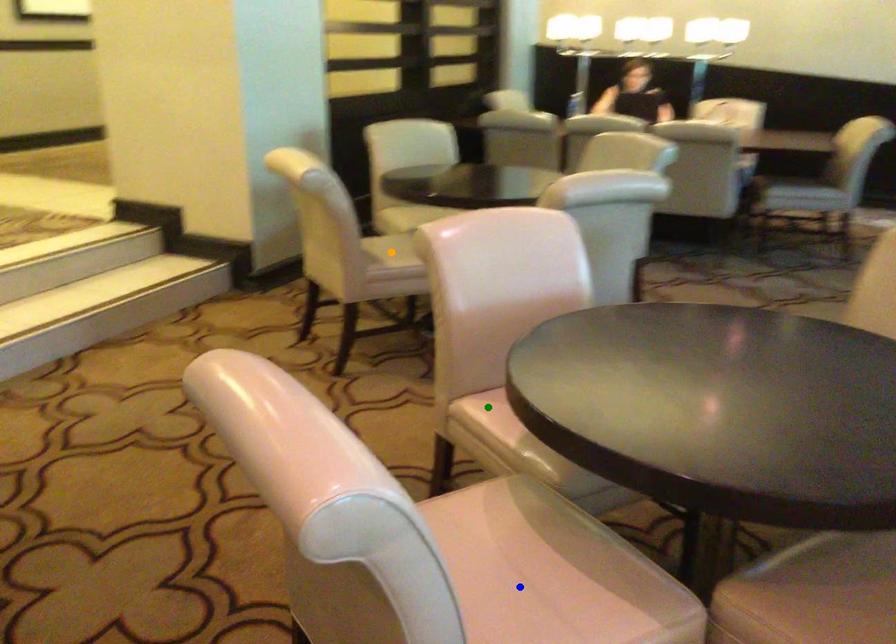
Order these from nearest to farthest:
orange point | green point | blue point

1. blue point
2. green point
3. orange point